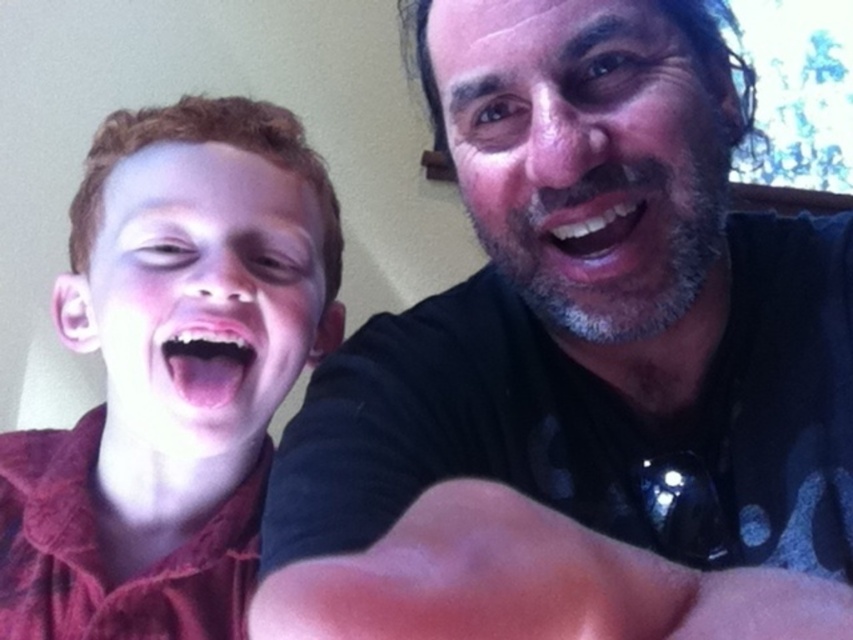
From the picture: Is the position of matte red shirt at left more distant than that of smooth skin mouth at center?

Yes.

Measure the distance between point (x=223, y=180) and camera.

Point (x=223, y=180) and camera are 25.84 inches apart from each other.

The width and height of the screenshot is (853, 640). Find the location of `matte red shirt at left`. matte red shirt at left is located at coordinates (171, 372).

Is pink flesh muscle at lower center bigger than pink flesh-colored mouth at center?

Correct, pink flesh muscle at lower center is larger in size than pink flesh-colored mouth at center.

The width and height of the screenshot is (853, 640). Identify the location of pink flesh muscle at lower center. (529, 582).

Is matte red shirt at left wider than pink flesh-colored mouth at center?

Yes, matte red shirt at left is wider than pink flesh-colored mouth at center.

Does point (106, 499) come in front of point (158, 339)?

No, (106, 499) is behind (158, 339).

Locate an element on the screen. The height and width of the screenshot is (640, 853). matte red shirt at left is located at coordinates (171, 372).